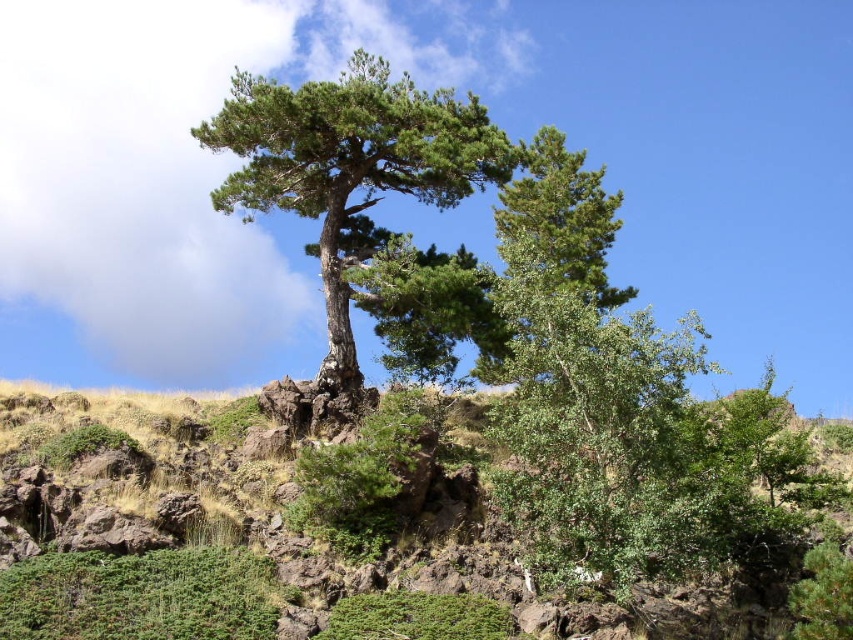
Question: Does green leafy shrubs at center appear under green textured tree at center?

Choices:
 (A) yes
 (B) no

Answer: (A)

Question: Is green leafy shrubs at center to the right of green textured tree at center from the viewer's perspective?

Choices:
 (A) no
 (B) yes

Answer: (B)

Question: Which point is closer to the camera?

Choices:
 (A) green leafy shrubs at center
 (B) green textured tree at center

Answer: (A)

Question: Observing the image, what is the correct spatial positioning of green leafy shrubs at center in reference to green textured tree at center?

Choices:
 (A) right
 (B) left

Answer: (A)

Question: Which point is closer to the camera?

Choices:
 (A) (334, 534)
 (B) (445, 168)

Answer: (A)